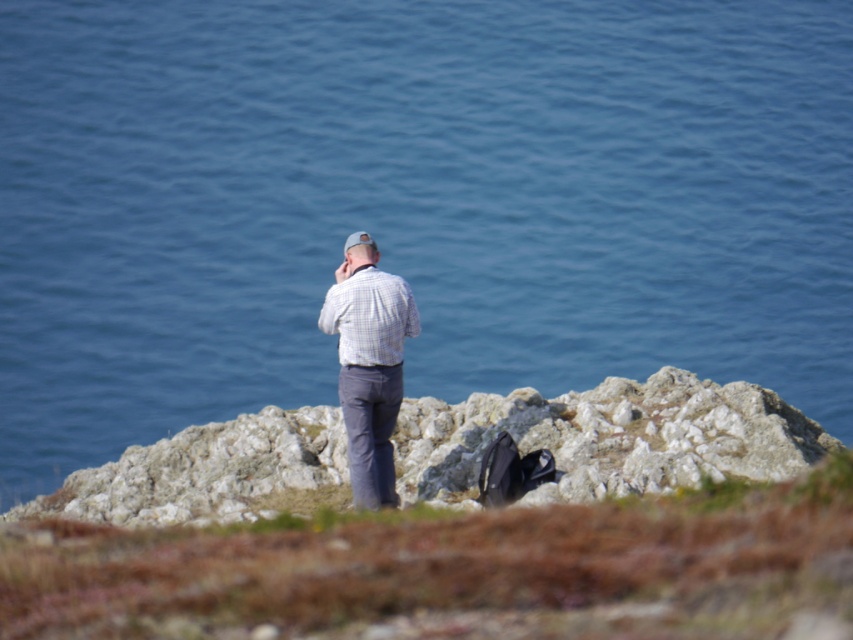
You are a hiker who wants to take a photo of the rugged stone cliff at center while standing on the white checkered shirt at center. Is the cliff visible from your current position?

The rugged stone cliff at center is positioned under the white checkered shirt at center, so the cliff would be visible from the position of the white checkered shirt at center since it is directly below it.

You are a photographer planning to capture the rugged stone cliff at center and the white checkered shirt at center in a single frame. Based on their widths, which object should you prioritize positioning closer to the center of the frame to ensure both fit well?

The rugged stone cliff at center is wider than the white checkered shirt at center. To ensure both fit well in the frame, prioritize positioning the rugged stone cliff at center closer to the center of the frame since it requires more space.